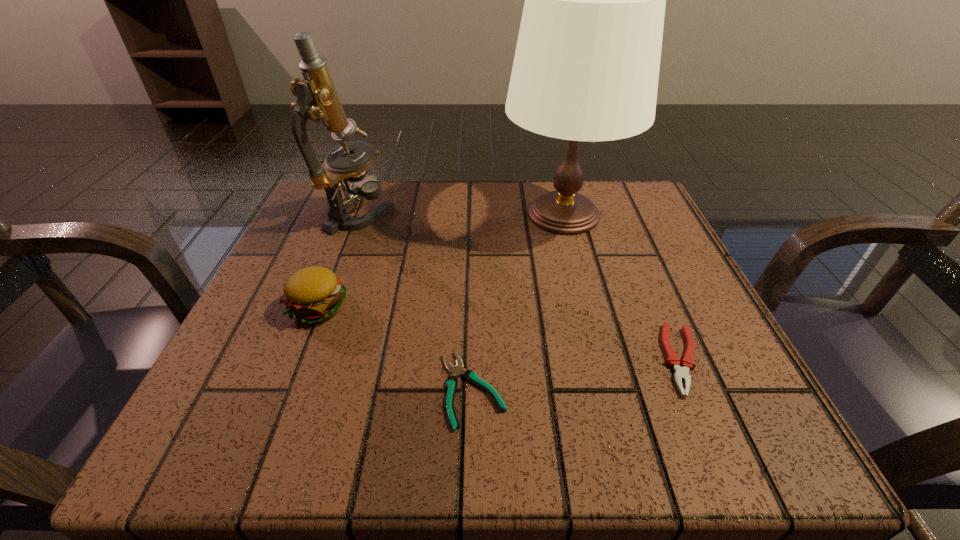
At what (x,y) coordinates should I click in order to perform the action: click on object present at the near right corner. Please return your answer as a coordinate pair (x, y). Image resolution: width=960 pixels, height=540 pixels. Looking at the image, I should click on (681, 373).

In order to click on vacant space at the far edge of the desktop in this screenshot , I will do `click(464, 205)`.

Find the location of `free space at the near edge of the desktop`. free space at the near edge of the desktop is located at coordinates (456, 435).

In the image, there is a desktop. Find the location of `vacant space at the left edge`. vacant space at the left edge is located at coordinates (292, 246).

Find the location of a particular element. vacant space at the right edge of the desktop is located at coordinates (672, 286).

In the image, there is a desktop. What are the coordinates of `vacant space at the far left corner` in the screenshot? It's located at (301, 232).

Locate an element on the screen. This screenshot has width=960, height=540. free space at the near left corner is located at coordinates (240, 402).

Identify the location of free space at the far right corner of the desktop. (609, 194).

Where is `blank region between the taller pliers and the third object from right to left`? blank region between the taller pliers and the third object from right to left is located at coordinates (577, 374).

This screenshot has height=540, width=960. In order to click on blank region between the third tallest object and the third object from left to right in this screenshot , I will do `click(396, 348)`.